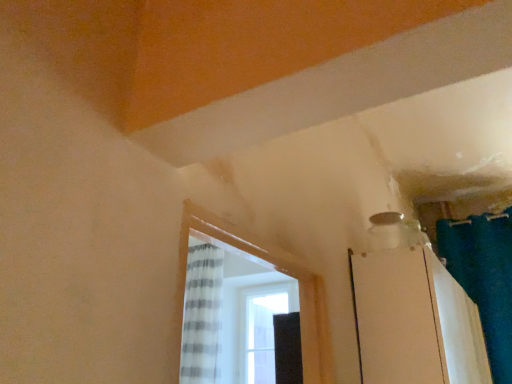
Question: From a real-world perspective, is white glossy screen door at upper right positioned under teal fabric shower curtain at upper right based on gravity?

Choices:
 (A) no
 (B) yes

Answer: (B)

Question: Does white glossy screen door at upper right have a lesser height compared to teal fabric shower curtain at upper right?

Choices:
 (A) no
 (B) yes

Answer: (B)

Question: From the image's perspective, is white glossy screen door at upper right on top of teal fabric shower curtain at upper right?

Choices:
 (A) no
 (B) yes

Answer: (A)

Question: Is white glossy screen door at upper right positioned with its back to teal fabric shower curtain at upper right?

Choices:
 (A) no
 (B) yes

Answer: (A)

Question: Does white glossy screen door at upper right have a smaller size compared to teal fabric shower curtain at upper right?

Choices:
 (A) no
 (B) yes

Answer: (A)

Question: Is white glossy screen door at upper right positioned behind teal fabric shower curtain at upper right?

Choices:
 (A) no
 (B) yes

Answer: (A)

Question: Is teal fabric shower curtain at upper right smaller than white glossy screen door at upper right?

Choices:
 (A) yes
 (B) no

Answer: (A)

Question: Could you tell me if teal fabric shower curtain at upper right is turned towards white glossy screen door at upper right?

Choices:
 (A) no
 (B) yes

Answer: (B)

Question: Is teal fabric shower curtain at upper right taller than white glossy screen door at upper right?

Choices:
 (A) yes
 (B) no

Answer: (A)

Question: From a real-world perspective, is teal fabric shower curtain at upper right positioned over white glossy screen door at upper right based on gravity?

Choices:
 (A) yes
 (B) no

Answer: (A)

Question: Can you confirm if teal fabric shower curtain at upper right is wider than white glossy screen door at upper right?

Choices:
 (A) no
 (B) yes

Answer: (A)

Question: Would you say white glossy screen door at upper right is part of teal fabric shower curtain at upper right's contents?

Choices:
 (A) yes
 (B) no

Answer: (B)

Question: Considering the positions of teal fabric shower curtain at upper right and white glossy screen door at upper right in the image, is teal fabric shower curtain at upper right bigger or smaller than white glossy screen door at upper right?

Choices:
 (A) big
 (B) small

Answer: (B)